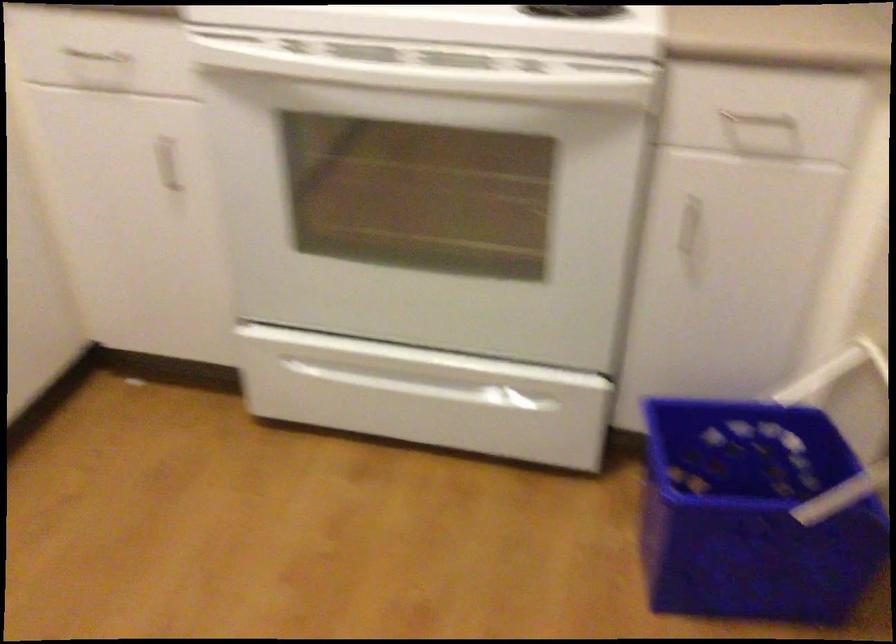
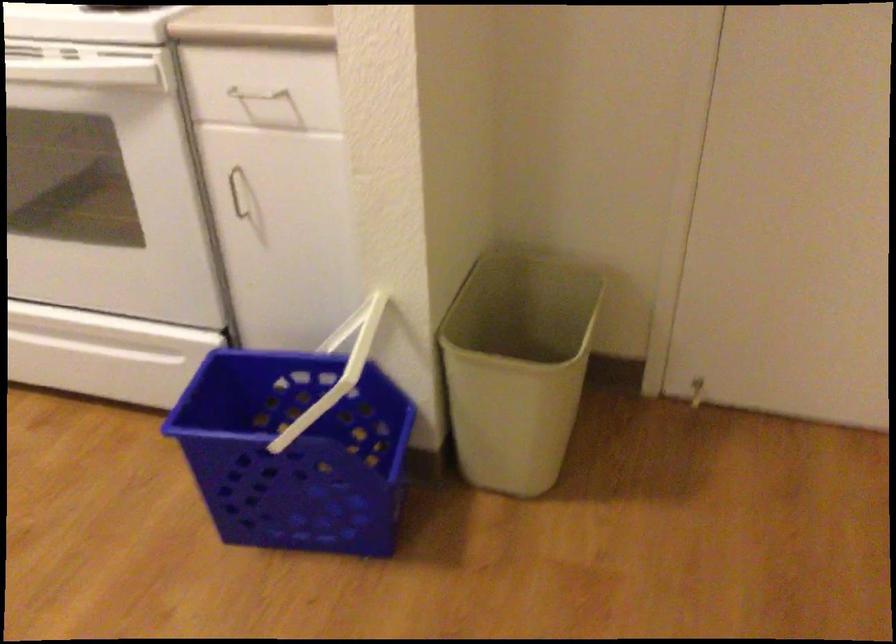
Locate, in the second image, the point that corresponds to the point at 678,218 in the first image.

(237, 192)